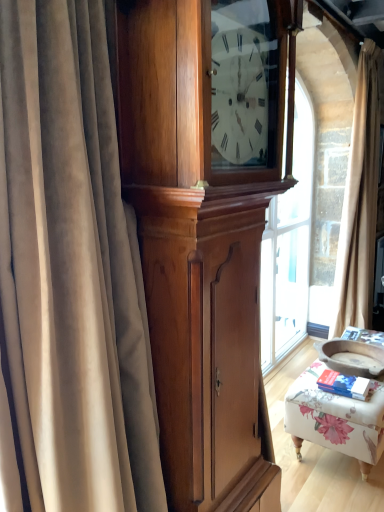
What do you see at coordinates (359, 203) in the screenshot? I see `beige velvet curtain at right, the 2th curtain positioned from the front` at bounding box center [359, 203].

The height and width of the screenshot is (512, 384). Describe the element at coordinates (69, 275) in the screenshot. I see `velvet curtain at left, which is the 1th curtain in front-to-back order` at that location.

Locate an element on the screen. floral fabric ottoman at lower right is located at coordinates (336, 419).

In the scene shown: Is floral fabric ottoman at lower right closer to the viewer compared to polished wood cabinet at center?

No, it is not.

Which is more to the right, floral fabric ottoman at lower right or polished wood cabinet at center?

From the viewer's perspective, floral fabric ottoman at lower right appears more on the right side.

Where is `cabinetry that is above the floral fabric ottoman at lower right (from a real-world perspective)`? cabinetry that is above the floral fabric ottoman at lower right (from a real-world perspective) is located at coordinates (204, 232).

In terms of width, does floral fabric ottoman at lower right look wider or thinner when compared to polished wood cabinet at center?

floral fabric ottoman at lower right is wider than polished wood cabinet at center.

Is point (307, 418) in front of point (84, 9)?

No, it is not.

Measure the distance between floral fabric ottoman at lower right and velvet curtain at left, which is the 1th curtain in front-to-back order.

A distance of 1.33 meters exists between floral fabric ottoman at lower right and velvet curtain at left, which is the 1th curtain in front-to-back order.

From the image's perspective, does floral fabric ottoman at lower right appear lower than velvet curtain at left, arranged as the first curtain when viewed from the left?

Indeed, from the image's perspective, floral fabric ottoman at lower right is shown beneath velvet curtain at left, arranged as the first curtain when viewed from the left.

Considering the sizes of objects floral fabric ottoman at lower right and velvet curtain at left, positioned as the second curtain in back-to-front order, in the image provided, who is smaller, floral fabric ottoman at lower right or velvet curtain at left, positioned as the second curtain in back-to-front order,?

floral fabric ottoman at lower right.

Which object is positioned more to the left, polished wood cabinet at center or velvet curtain at left, which is the 1th curtain in front-to-back order?

Positioned to the left is velvet curtain at left, which is the 1th curtain in front-to-back order.

In the image, is polished wood cabinet at center positioned in front of or behind velvet curtain at left, which is the 1th curtain in front-to-back order?

polished wood cabinet at center is behind velvet curtain at left, which is the 1th curtain in front-to-back order.

Is polished wood cabinet at center aimed at velvet curtain at left, which is the 1th curtain in front-to-back order?

No, polished wood cabinet at center is not facing towards velvet curtain at left, which is the 1th curtain in front-to-back order.

From the image's perspective, is polished wood cabinet at center located above or below velvet curtain at left, positioned as the 2th curtain in right-to-left order?

polished wood cabinet at center is situated lower than velvet curtain at left, positioned as the 2th curtain in right-to-left order, in the image.

Based on the photo, choose the correct answer: Is polished wood cabinet at center inside beige velvet curtain at right, marked as the 1th curtain in a back-to-front arrangement, or outside it?

polished wood cabinet at center cannot be found inside beige velvet curtain at right, marked as the 1th curtain in a back-to-front arrangement.

This screenshot has height=512, width=384. Find the location of `cabinetry that is under the beige velvet curtain at right, marked as the 1th curtain in a back-to-front arrangement (from a real-world perspective)`. cabinetry that is under the beige velvet curtain at right, marked as the 1th curtain in a back-to-front arrangement (from a real-world perspective) is located at coordinates (204, 232).

Based on the photo, visually, is beige velvet curtain at right, which ranks as the 2th curtain in left-to-right order, positioned to the left or to the right of floral fabric ottoman at lower right?

Based on their positions, beige velvet curtain at right, which ranks as the 2th curtain in left-to-right order, is located to the right of floral fabric ottoman at lower right.

From their relative heights in the image, would you say beige velvet curtain at right, marked as the 1th curtain in a right-to-left arrangement, is taller or shorter than floral fabric ottoman at lower right?

Considering their sizes, beige velvet curtain at right, marked as the 1th curtain in a right-to-left arrangement, has more height than floral fabric ottoman at lower right.

Is beige velvet curtain at right, marked as the 1th curtain in a right-to-left arrangement, looking in the opposite direction of floral fabric ottoman at lower right?

That's not correct — beige velvet curtain at right, marked as the 1th curtain in a right-to-left arrangement, is not looking away from floral fabric ottoman at lower right.

Does beige velvet curtain at right, marked as the 1th curtain in a right-to-left arrangement, come behind floral fabric ottoman at lower right?

Yes, it is behind floral fabric ottoman at lower right.

Is polished wood cabinet at center smaller than floral fabric ottoman at lower right?

Actually, polished wood cabinet at center might be larger than floral fabric ottoman at lower right.

Where is `cabinetry that is in front of the floral fabric ottoman at lower right`? cabinetry that is in front of the floral fabric ottoman at lower right is located at coordinates (204, 232).

From the image's perspective, which is below, polished wood cabinet at center or floral fabric ottoman at lower right?

From the image's view, floral fabric ottoman at lower right is below.

How many degrees apart are the facing directions of velvet curtain at left, arranged as the first curtain when viewed from the left, and beige velvet curtain at right, marked as the 1th curtain in a right-to-left arrangement?

There is a 6-degree angle between the facing directions of velvet curtain at left, arranged as the first curtain when viewed from the left, and beige velvet curtain at right, marked as the 1th curtain in a right-to-left arrangement.

Looking at this image, is velvet curtain at left, positioned as the 2th curtain in right-to-left order, surrounding beige velvet curtain at right, marked as the 1th curtain in a back-to-front arrangement?

No, beige velvet curtain at right, marked as the 1th curtain in a back-to-front arrangement, is located outside of velvet curtain at left, positioned as the 2th curtain in right-to-left order.

Is velvet curtain at left, arranged as the first curtain when viewed from the left, looking in the opposite direction of beige velvet curtain at right, which ranks as the 2th curtain in left-to-right order?

No, velvet curtain at left, arranged as the first curtain when viewed from the left,'s orientation is not away from beige velvet curtain at right, which ranks as the 2th curtain in left-to-right order.

Identify the location of furniture lying below the polished wood cabinet at center (from the image's perspective). (336, 419).

The width and height of the screenshot is (384, 512). In order to click on the 1st curtain above the floral fabric ottoman at lower right (from a real-world perspective) in this screenshot , I will do `click(69, 275)`.

Based on their spatial positions, is polished wood cabinet at center or velvet curtain at left, positioned as the 2th curtain in right-to-left order, further from beige velvet curtain at right, marked as the 1th curtain in a right-to-left arrangement?

Among the two, velvet curtain at left, positioned as the 2th curtain in right-to-left order, is located further to beige velvet curtain at right, marked as the 1th curtain in a right-to-left arrangement.

Based on their spatial positions, is floral fabric ottoman at lower right or beige velvet curtain at right, marked as the 1th curtain in a back-to-front arrangement, further from polished wood cabinet at center?

The object further to polished wood cabinet at center is beige velvet curtain at right, marked as the 1th curtain in a back-to-front arrangement.

When comparing their distances from polished wood cabinet at center, does beige velvet curtain at right, the 2th curtain positioned from the front, or floral fabric ottoman at lower right seem closer?

floral fabric ottoman at lower right is positioned closer to the anchor polished wood cabinet at center.

Which object lies further to the anchor point beige velvet curtain at right, marked as the 1th curtain in a right-to-left arrangement, velvet curtain at left, arranged as the first curtain when viewed from the left, or floral fabric ottoman at lower right?

velvet curtain at left, arranged as the first curtain when viewed from the left, is further to beige velvet curtain at right, marked as the 1th curtain in a right-to-left arrangement.

When comparing their distances from floral fabric ottoman at lower right, does velvet curtain at left, positioned as the second curtain in back-to-front order, or beige velvet curtain at right, which ranks as the 2th curtain in left-to-right order, seem further?

velvet curtain at left, positioned as the second curtain in back-to-front order, is further to floral fabric ottoman at lower right.

Estimate the real-world distances between objects in this image. Which object is further from floral fabric ottoman at lower right, beige velvet curtain at right, which ranks as the 2th curtain in left-to-right order, or velvet curtain at left, positioned as the 2th curtain in right-to-left order?

velvet curtain at left, positioned as the 2th curtain in right-to-left order, lies further to floral fabric ottoman at lower right than the other object.

Which object lies nearer to the anchor point beige velvet curtain at right, marked as the 1th curtain in a right-to-left arrangement, velvet curtain at left, arranged as the first curtain when viewed from the left, or polished wood cabinet at center?

polished wood cabinet at center.

Based on their spatial positions, is floral fabric ottoman at lower right or velvet curtain at left, positioned as the second curtain in back-to-front order, closer to beige velvet curtain at right, marked as the 1th curtain in a right-to-left arrangement?

floral fabric ottoman at lower right is closer to beige velvet curtain at right, marked as the 1th curtain in a right-to-left arrangement.

Locate an element on the screen. cabinetry between velvet curtain at left, arranged as the first curtain when viewed from the left, and beige velvet curtain at right, the 2th curtain positioned from the front, along the z-axis is located at coordinates (204, 232).

At what (x,y) coordinates should I click in order to perform the action: click on cabinetry between velvet curtain at left, positioned as the 2th curtain in right-to-left order, and floral fabric ottoman at lower right in the front-back direction. Please return your answer as a coordinate pair (x, y). The width and height of the screenshot is (384, 512). Looking at the image, I should click on (204, 232).

Where is `furniture between velvet curtain at left, arranged as the first curtain when viewed from the left, and beige velvet curtain at right, which ranks as the 2th curtain in left-to-right order, from front to back`? The width and height of the screenshot is (384, 512). furniture between velvet curtain at left, arranged as the first curtain when viewed from the left, and beige velvet curtain at right, which ranks as the 2th curtain in left-to-right order, from front to back is located at coordinates (336, 419).

Where is `furniture between polished wood cabinet at center and beige velvet curtain at right, which ranks as the 2th curtain in left-to-right order, along the z-axis`? furniture between polished wood cabinet at center and beige velvet curtain at right, which ranks as the 2th curtain in left-to-right order, along the z-axis is located at coordinates pyautogui.click(x=336, y=419).